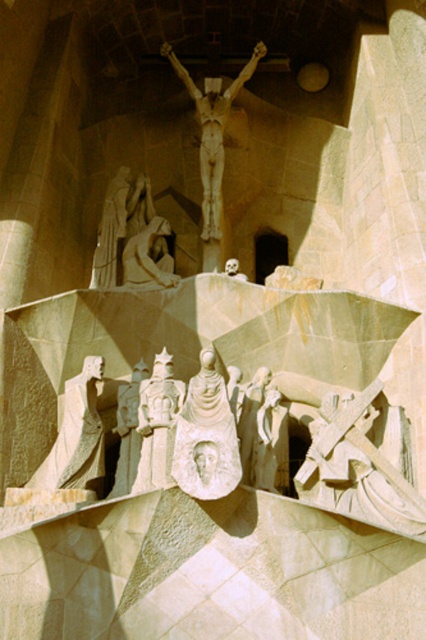
Question: Is carved stone cross at lower right above matte stone statue at center?

Choices:
 (A) no
 (B) yes

Answer: (A)

Question: Based on their relative distances, which object is nearer to the matte stone statue at center?

Choices:
 (A) carved stone cross at lower right
 (B) smooth beige statue at lower left

Answer: (A)

Question: Which point is closer to the camera taking this photo?

Choices:
 (A) (250, 444)
 (B) (83, 376)

Answer: (A)

Question: Which object is closer to the camera taking this photo?

Choices:
 (A) carved stone cross at lower right
 (B) matte stone statue at center
 (C) smooth beige statue at lower left

Answer: (A)

Question: Considering the relative positions of smooth beige statue at lower left and matte stone statue at center in the image provided, where is smooth beige statue at lower left located with respect to matte stone statue at center?

Choices:
 (A) right
 (B) left

Answer: (B)

Question: From the image, what is the correct spatial relationship of carved stone cross at lower right in relation to matte stone statue at center?

Choices:
 (A) above
 (B) below

Answer: (B)